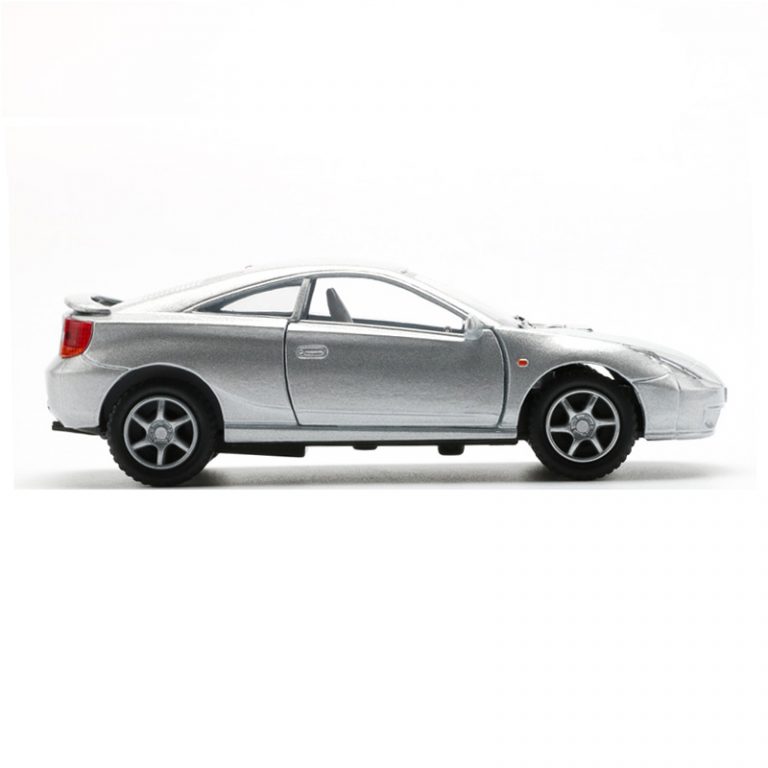
The width and height of the screenshot is (768, 768). In order to click on door handle in this screenshot , I will do `click(303, 352)`.